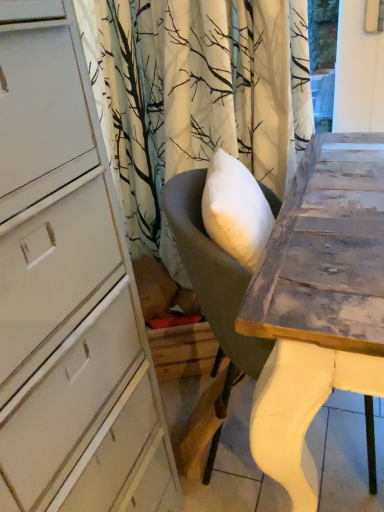
This screenshot has width=384, height=512. Describe the element at coordinates (317, 305) in the screenshot. I see `wooden rustic table at center` at that location.

Locate an element on the screen. wooden rustic table at center is located at coordinates (317, 305).

I want to click on wooden rustic table at center, so click(317, 305).